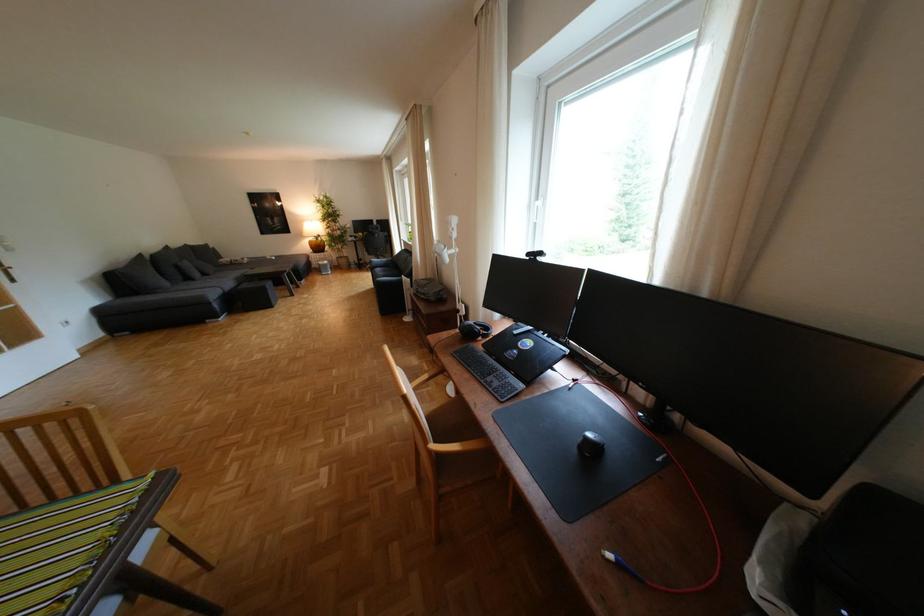
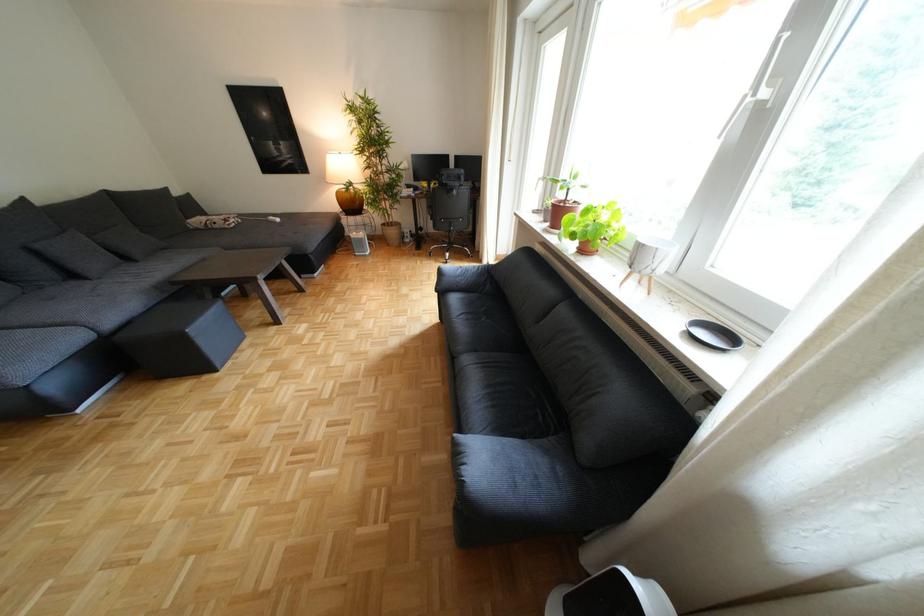
Which direction would the cameraman need to move to produce the second image?

The cameraman moved toward left, forward.